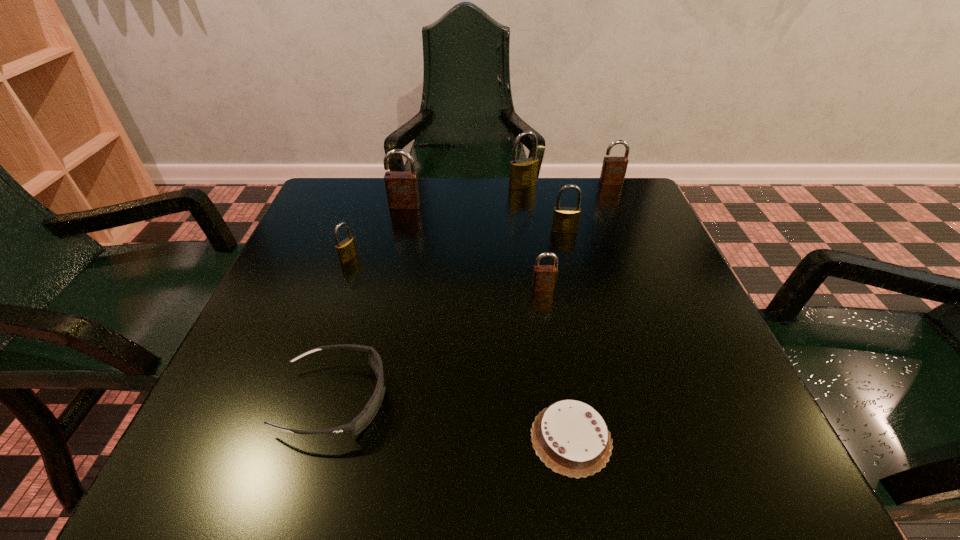
Image resolution: width=960 pixels, height=540 pixels. I want to click on brass padlock object that ranks as the closest to the fourth farthest object, so click(x=523, y=173).

Locate which brass padlock ranks second in proximity to the black goggles. Please provide its 2D coordinates. Your answer should be formatted as a tuple, i.e. [(x, y)], where the tuple contains the x and y coordinates of a point satisfying the conditions above.

[(565, 219)]

This screenshot has width=960, height=540. Find the location of `brown padlock that can be found as the third closest to the chocolate cake`. brown padlock that can be found as the third closest to the chocolate cake is located at coordinates (613, 171).

Locate which brown padlock ranks second in proximity to the rightmost brass padlock. Please provide its 2D coordinates. Your answer should be formatted as a tuple, i.e. [(x, y)], where the tuple contains the x and y coordinates of a point satisfying the conditions above.

[(613, 171)]

At what (x,y) coordinates should I click in order to perform the action: click on vacant space that satisfies the following two spatial constraints: 1. on the front-facing side of the second biggest brass padlock; 2. on the left side of the second padlock from left to right. Please return your answer as a coordinate pair (x, y). Looking at the image, I should click on (398, 231).

This screenshot has height=540, width=960. Identify the location of vacant space that satisfies the following two spatial constraints: 1. on the front side of the fourth farthest padlock; 2. on the left side of the second brass padlock from left to right. (529, 231).

Where is `vacant position in the image that satisfies the following two spatial constraints: 1. on the lenses of the black goggles; 2. on the back side of the shortest object`? The height and width of the screenshot is (540, 960). vacant position in the image that satisfies the following two spatial constraints: 1. on the lenses of the black goggles; 2. on the back side of the shortest object is located at coordinates (324, 438).

Image resolution: width=960 pixels, height=540 pixels. I want to click on vacant space that satisfies the following two spatial constraints: 1. on the front-facing side of the chocolate cake; 2. on the right side of the biggest brown padlock, so click(x=351, y=438).

Locate an element on the screen. This screenshot has width=960, height=540. free space that satisfies the following two spatial constraints: 1. on the front-facing side of the farthest brown padlock; 2. on the lenses of the seventh tallest object is located at coordinates (705, 400).